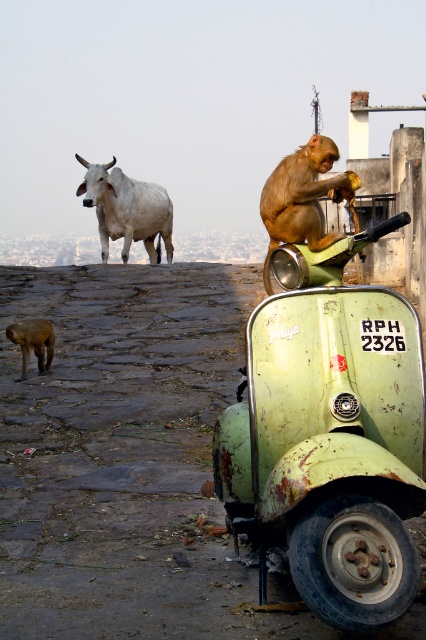
You are a photographer trying to capture both the brown furry monkey at center and the brown furry dog at lower left in the same frame. Given that your camera has a focal length of 50mm, which is suitable for capturing subjects within a 3.0 meters distance apart, will you be able to include both subjects in the photo?

The brown furry monkey at center and brown furry dog at lower left are 2.70 meters apart, which is within the 3.0 meters range of the camera. Therefore, both subjects can be captured in the same frame.

You are a photographer trying to capture both the brown furry monkey at center and the white smooth cow at upper left in a single shot. Based on their positions, which one is closer to the camera?

The brown furry monkey at center is closer to the camera because it is positioned to the right of the white smooth cow at upper left.

You are a wildlife observer in the area. You see a brown furry monkey at center and a brown furry dog at lower left. Which animal is bigger?

The brown furry monkey at center is larger in size compared to the brown furry dog at lower left.